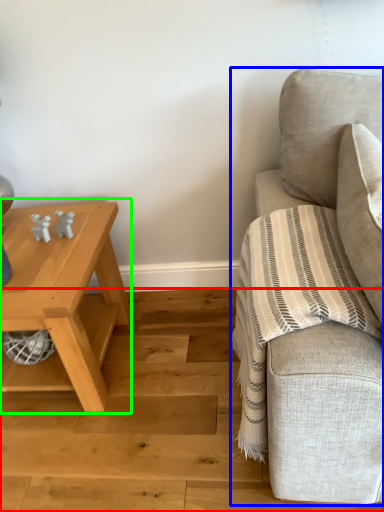
Question: Which is nearer to the stair (highlighted by a red box)? studio couch (highlighted by a blue box) or table (highlighted by a green box).

Choices:
 (A) studio couch
 (B) table

Answer: (B)